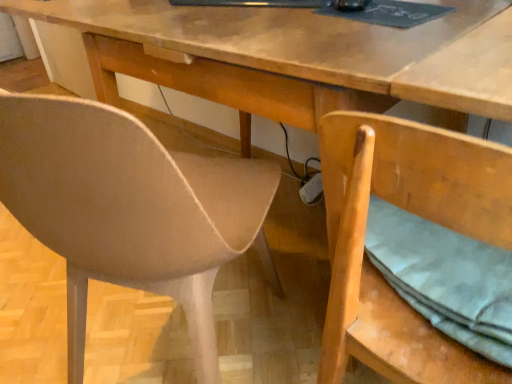
Where is `vacant location below matte beige chair at left, arranged as the 1th chair when viewed from the left (from a real-world perspective)`? vacant location below matte beige chair at left, arranged as the 1th chair when viewed from the left (from a real-world perspective) is located at coordinates (174, 344).